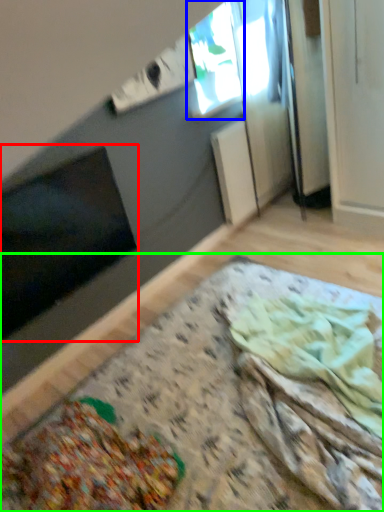
Question: Which object is the farthest from window screen (highlighted by a red box)? Choose among these: window (highlighted by a blue box) or table (highlighted by a green box).

Choices:
 (A) window
 (B) table

Answer: (A)